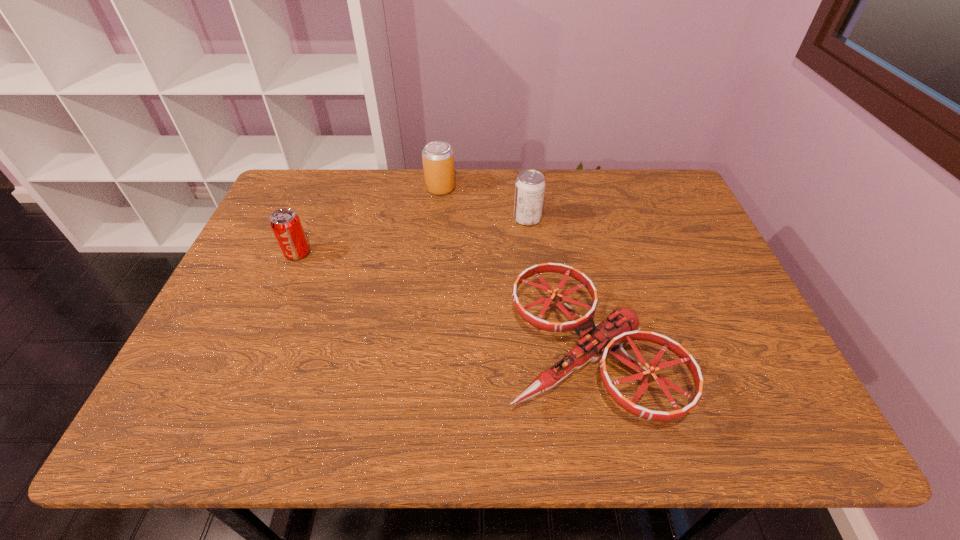
This screenshot has width=960, height=540. What are the coordinates of `free space located on the front of the nearest soda can` in the screenshot? It's located at (269, 323).

Locate an element on the screen. The width and height of the screenshot is (960, 540). vacant space situated on the right of the nearest object is located at coordinates (721, 355).

The width and height of the screenshot is (960, 540). What are the coordinates of `object positioned at the near edge` in the screenshot? It's located at (596, 340).

At what (x,y) coordinates should I click in order to perform the action: click on object that is positioned at the left edge. Please return your answer as a coordinate pair (x, y). Looking at the image, I should click on (285, 223).

Image resolution: width=960 pixels, height=540 pixels. Identify the location of free region at the far edge. (435, 198).

In the image, there is a desktop. At what (x,y) coordinates should I click in order to perform the action: click on vacant area at the near edge. Please return your answer as a coordinate pair (x, y). Looking at the image, I should click on (606, 434).

In the image, there is a desktop. Find the location of `free space at the left edge`. free space at the left edge is located at coordinates (256, 271).

The width and height of the screenshot is (960, 540). What are the coordinates of `vacant space at the far left corner` in the screenshot? It's located at (272, 211).

The width and height of the screenshot is (960, 540). Find the location of `vacant position at the far right corner of the desktop`. vacant position at the far right corner of the desktop is located at coordinates (679, 207).

You are a GUI agent. You are given a task and a screenshot of the screen. Output one action in this format:
    pyautogui.click(x=<x>, y=<y>)
    Task: Click on the free space at the near right corner of the desktop
    The image size is (960, 540).
    Given the screenshot: What is the action you would take?
    pyautogui.click(x=747, y=416)